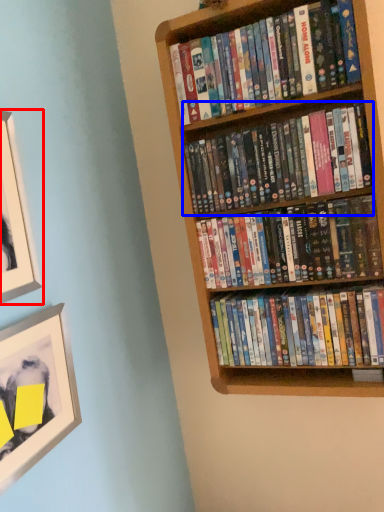
Question: Which of the following is the farthest to the observer, picture frame (highlighted by a red box) or book (highlighted by a blue box)?

Choices:
 (A) picture frame
 (B) book

Answer: (B)